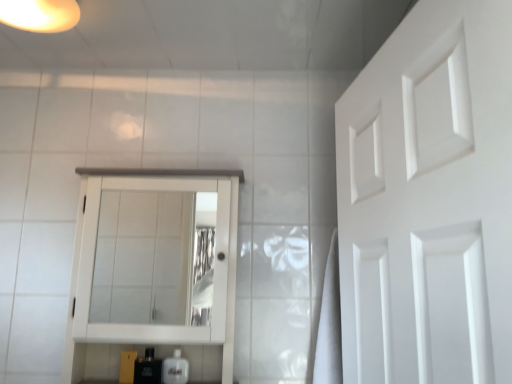
Question: Is matte yellow light fixture at upper left to the left or to the right of black glossy bottle at lower left, positioned as the 1th toiletry in left-to-right order, in the image?

Choices:
 (A) left
 (B) right

Answer: (A)

Question: Considering the positions of matte yellow light fixture at upper left and black glossy bottle at lower left, positioned as the 1th toiletry in left-to-right order, in the image, is matte yellow light fixture at upper left taller or shorter than black glossy bottle at lower left, positioned as the 1th toiletry in left-to-right order,?

Choices:
 (A) tall
 (B) short

Answer: (B)

Question: Which of these objects is positioned farthest from the black glossy bottle at lower left, positioned as the 1th toiletry in left-to-right order?

Choices:
 (A) white wood medicine cabinet at center
 (B) white matte door at right
 (C) matte yellow light fixture at upper left
 (D) translucent plastic soap at lower center, the 1th toiletry positioned from the right

Answer: (C)

Question: Which is farther from the white wood medicine cabinet at center?

Choices:
 (A) white matte door at right
 (B) translucent plastic soap at lower center, the 1th toiletry positioned from the right
 (C) matte yellow light fixture at upper left
 (D) black glossy bottle at lower left, positioned as the 1th toiletry in left-to-right order

Answer: (C)